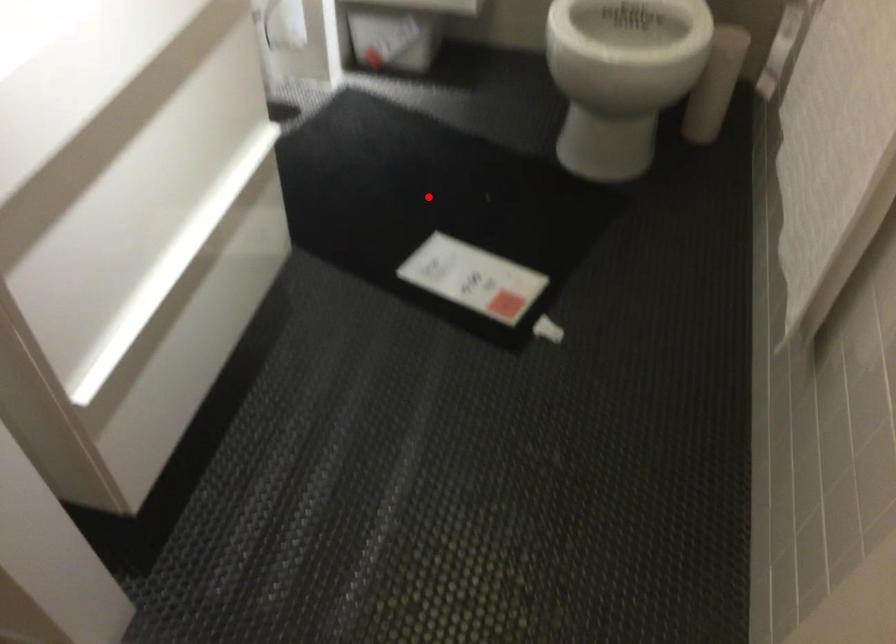
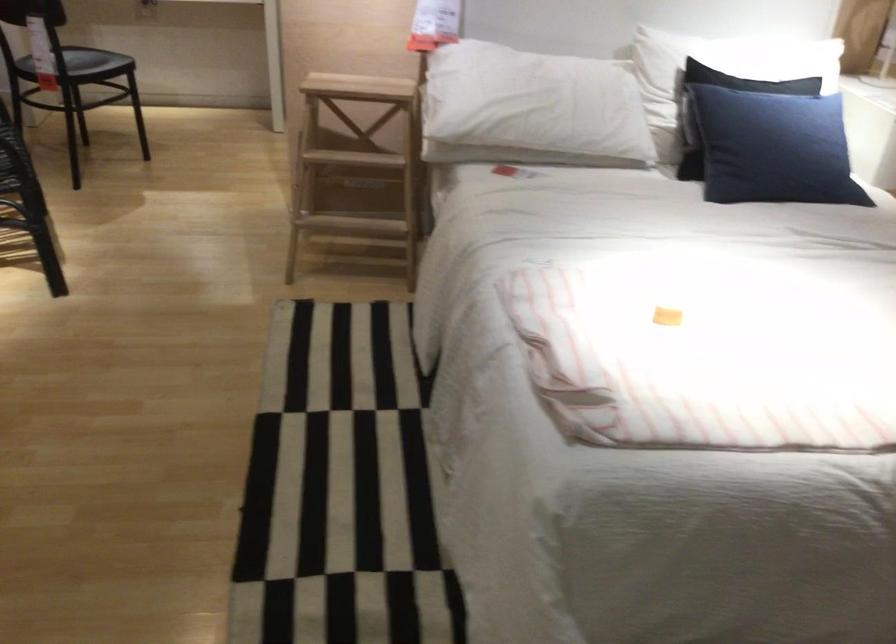
Question: I am providing you with two images of the same scene from different viewpoints. A red point is marked on the first image. Can you still see the location of the red point in image 2?

Choices:
 (A) Yes
 (B) No

Answer: (B)